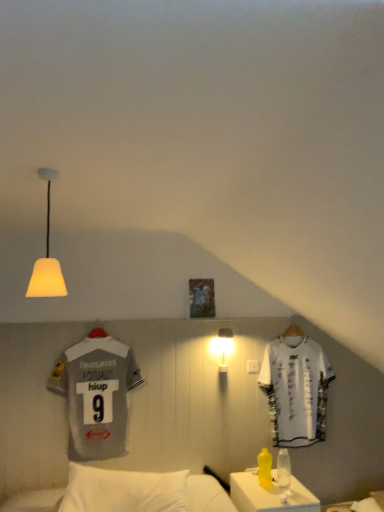
Find the location of a particular element. The image size is (384, 512). vacant position to the left of yellow translucent bottle at lower right, the second bottle positioned from the left is located at coordinates (263, 490).